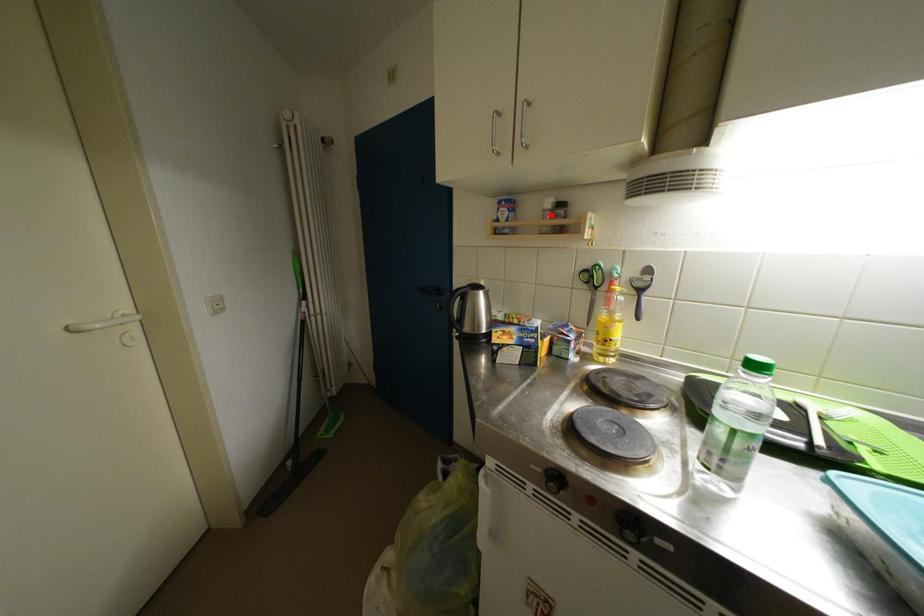
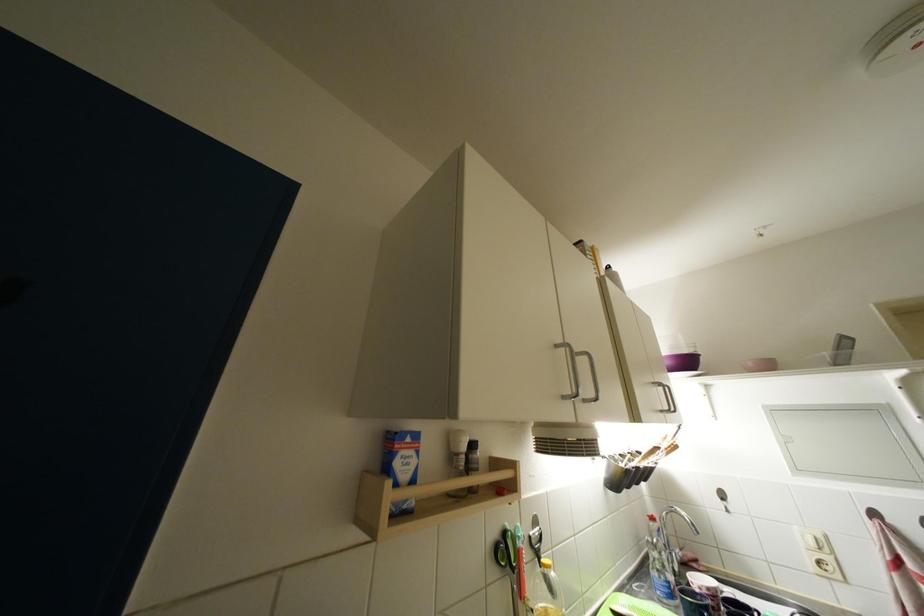
The point at the highlighted location is marked in the first image. Where is the corresponding point in the second image?

(464, 458)